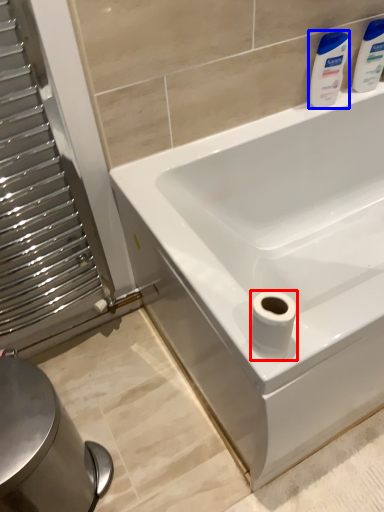
Question: Among these objects, which one is farthest to the camera, toilet paper (highlighted by a red box) or cleaning product (highlighted by a blue box)?

Choices:
 (A) toilet paper
 (B) cleaning product

Answer: (B)